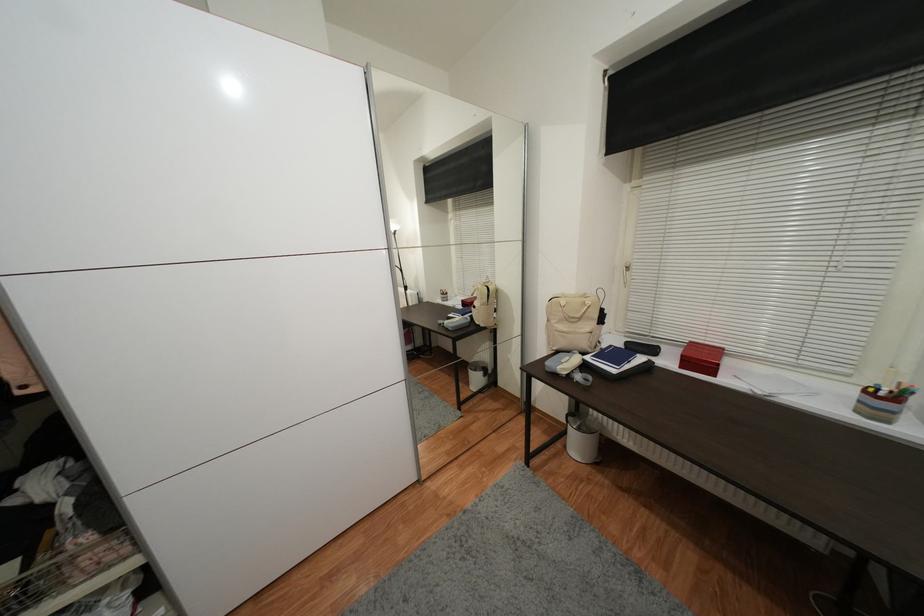
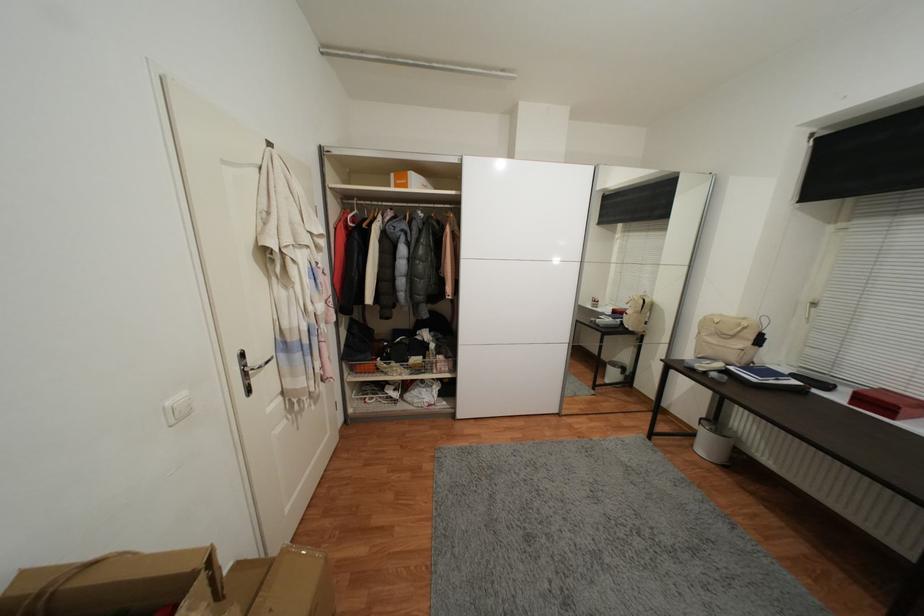
Locate, in the second image, the point that corresponds to pixel 589 297 in the first image.

(748, 321)